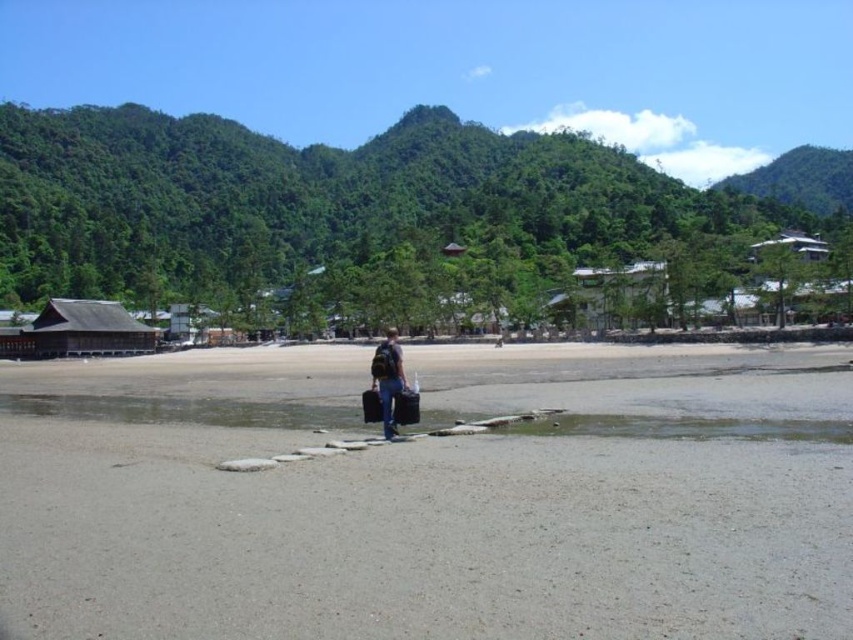
Question: Which object is the farthest from the green leafy mountain at upper right?

Choices:
 (A) wooden hut at left
 (B) dark blue jeans at center
 (C) gray sand at center
 (D) green leafy forest at upper left

Answer: (B)

Question: Can you confirm if gray sand at center is smaller than green leafy mountain at upper right?

Choices:
 (A) no
 (B) yes

Answer: (B)

Question: From the image, what is the correct spatial relationship of gray sand at center in relation to green leafy forest at upper left?

Choices:
 (A) above
 (B) below

Answer: (B)

Question: Can you confirm if gray sand at center is wider than green leafy forest at upper left?

Choices:
 (A) yes
 (B) no

Answer: (B)

Question: Which object appears closest to the camera in this image?

Choices:
 (A) green leafy forest at upper left
 (B) dark blue jeans at center

Answer: (B)

Question: Which point is farther to the camera?

Choices:
 (A) (109, 342)
 (B) (628, 196)

Answer: (B)